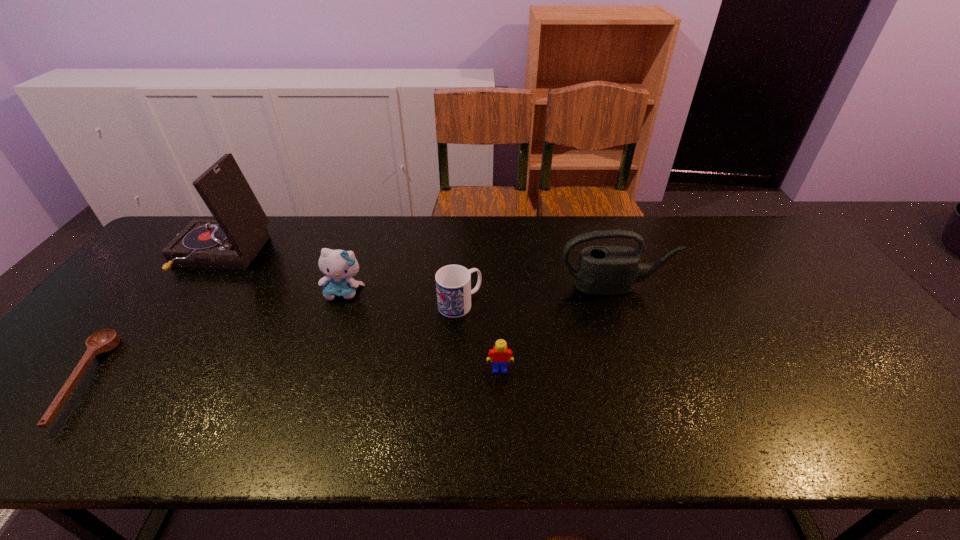
Identify the location of vacant region at the far edge. (x=358, y=221).

I want to click on free space at the near edge, so click(x=216, y=414).

Identify the location of vacant space at the left edge of the desktop. (177, 267).

This screenshot has width=960, height=540. In order to click on free space at the right edge of the desktop in this screenshot , I will do `click(882, 390)`.

Where is `free space at the near right corner of the desktop`? free space at the near right corner of the desktop is located at coordinates (878, 414).

You are a GUI agent. You are given a task and a screenshot of the screen. Output one action in this format:
    pyautogui.click(x=<x>, y=<y>)
    Task: Click on the free space between the rightmost object and the mug
    The image size is (960, 540).
    Given the screenshot: What is the action you would take?
    pyautogui.click(x=538, y=295)

This screenshot has height=540, width=960. I want to click on free point between the fourth object from right to left and the shortest object, so click(x=212, y=336).

Locate an element on the screen. The width and height of the screenshot is (960, 540). vacant area that lies between the mug and the rightmost object is located at coordinates (538, 295).

I want to click on free point between the wooden spoon and the fourth object from left to right, so click(x=271, y=342).

The height and width of the screenshot is (540, 960). What are the coordinates of `free spot between the wooden spoon and the third tallest object` in the screenshot? It's located at (212, 336).